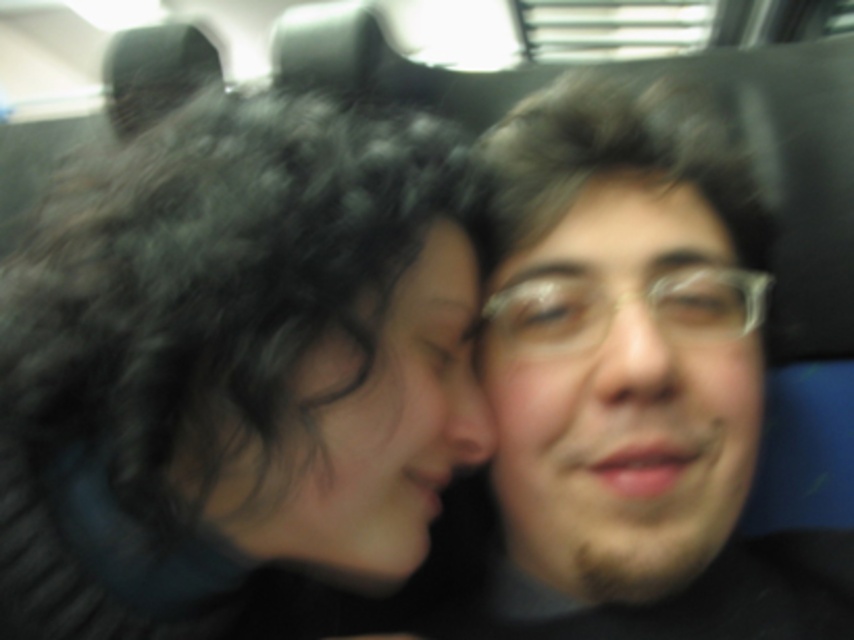
Is black curly hair at left further to camera compared to smooth skin face at center?

That is False.

Which is in front, point (253, 337) or point (662, 140)?

Positioned in front is point (253, 337).

Identify the location of black curly hair at left. (232, 364).